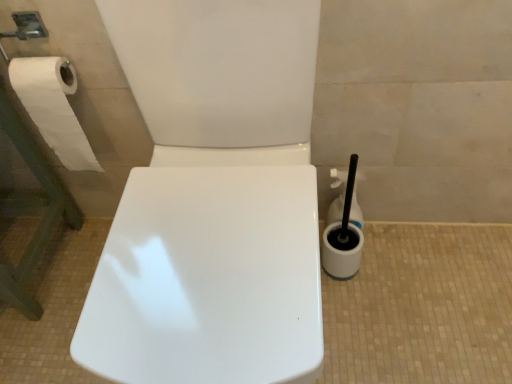
Question: Should I look upward or downward to see white plastic toilet brush at right, the second cleaning product viewed from the back?

Choices:
 (A) down
 (B) up

Answer: (A)

Question: Does white paper at left have a lesser width compared to white plastic toilet brush at right, the second cleaning product viewed from the back?

Choices:
 (A) yes
 (B) no

Answer: (A)

Question: Considering the relative sizes of white paper at left and white plastic toilet brush at right, which is the 1th cleaning product from front to back, in the image provided, is white paper at left smaller than white plastic toilet brush at right, which is the 1th cleaning product from front to back,?

Choices:
 (A) no
 (B) yes

Answer: (A)

Question: Can you confirm if white paper at left is wider than white plastic toilet brush at right, the second cleaning product viewed from the back?

Choices:
 (A) no
 (B) yes

Answer: (A)

Question: Does white paper at left appear on the right side of white plastic toilet brush at right, which is the 1th cleaning product from front to back?

Choices:
 (A) yes
 (B) no

Answer: (B)

Question: Is white paper at left facing away from white plastic toilet brush at right, the second cleaning product viewed from the back?

Choices:
 (A) no
 (B) yes

Answer: (A)

Question: Is white paper at left closer to the viewer compared to white plastic toilet brush at right, which is the 1th cleaning product from front to back?

Choices:
 (A) yes
 (B) no

Answer: (A)

Question: From the image's perspective, would you say white plastic cleaning product at right, the first cleaning product viewed from the back, is positioned over white plastic toilet brush at right, which is the 1th cleaning product from front to back?

Choices:
 (A) no
 (B) yes

Answer: (B)

Question: Does white plastic cleaning product at right, which ranks as the second cleaning product in front-to-back order, have a greater width compared to white plastic toilet brush at right, which is the 1th cleaning product from front to back?

Choices:
 (A) yes
 (B) no

Answer: (B)

Question: Does white plastic cleaning product at right, the first cleaning product viewed from the back, turn towards white plastic toilet brush at right, the second cleaning product viewed from the back?

Choices:
 (A) no
 (B) yes

Answer: (B)

Question: Is white plastic cleaning product at right, which ranks as the second cleaning product in front-to-back order, to the right of white plastic toilet brush at right, the second cleaning product viewed from the back, from the viewer's perspective?

Choices:
 (A) yes
 (B) no

Answer: (A)

Question: Is white plastic cleaning product at right, the first cleaning product viewed from the back, closer to camera compared to white plastic toilet brush at right, which is the 1th cleaning product from front to back?

Choices:
 (A) no
 (B) yes

Answer: (A)

Question: Are white plastic cleaning product at right, the first cleaning product viewed from the back, and white plastic toilet brush at right, which is the 1th cleaning product from front to back, making contact?

Choices:
 (A) yes
 (B) no

Answer: (A)

Question: Does white plastic toilet brush at right, which is the 1th cleaning product from front to back, have a greater height compared to white plastic cleaning product at right, which ranks as the second cleaning product in front-to-back order?

Choices:
 (A) yes
 (B) no

Answer: (A)